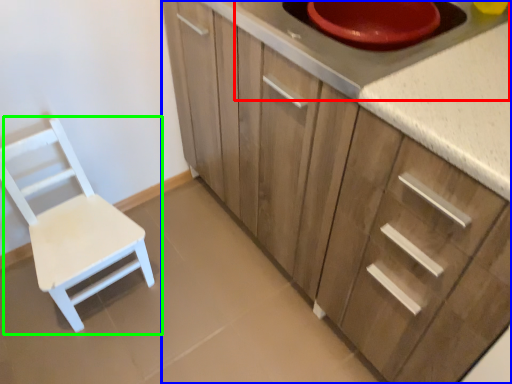
Question: Estimate the real-world distances between objects in this image. Which object is farther from appliance (highlighted by a red box), cabinetry (highlighted by a blue box) or chair (highlighted by a green box)?

Choices:
 (A) cabinetry
 (B) chair

Answer: (B)